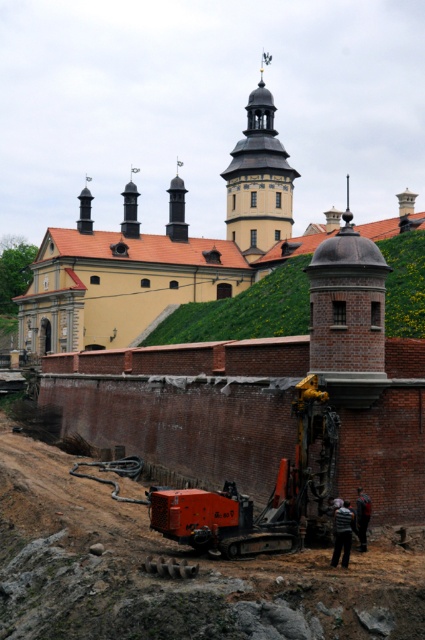
Does orange metallic excavator at center have a lesser height compared to green grassy hillside at center?

Correct, orange metallic excavator at center is not as tall as green grassy hillside at center.

Find the location of a particular element. Image resolution: width=425 pixels, height=640 pixels. orange metallic excavator at center is located at coordinates (251, 499).

Is point (110, 525) positioned behind point (203, 308)?

No, it is in front of (203, 308).

Is brown dirt track at lower center thinner than green grassy hillside at center?

Yes, brown dirt track at lower center is thinner than green grassy hillside at center.

The image size is (425, 640). I want to click on brown dirt track at lower center, so click(172, 577).

Does orange metallic excavator at center have a lesser width compared to matte yellow tower at center?

Correct, orange metallic excavator at center's width is less than matte yellow tower at center's.

Is orange metallic excavator at center smaller than matte yellow tower at center?

Yes, orange metallic excavator at center is smaller than matte yellow tower at center.

Does point (238, 552) come farther from viewer compared to point (263, 86)?

No, (238, 552) is in front of (263, 86).

Where is `orange metallic excavator at center`? This screenshot has width=425, height=640. orange metallic excavator at center is located at coordinates (251, 499).